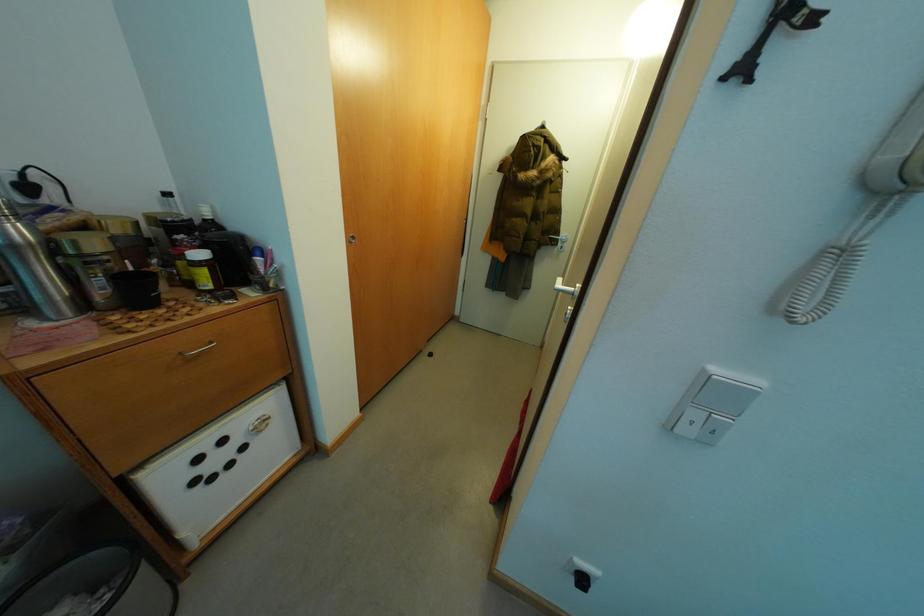
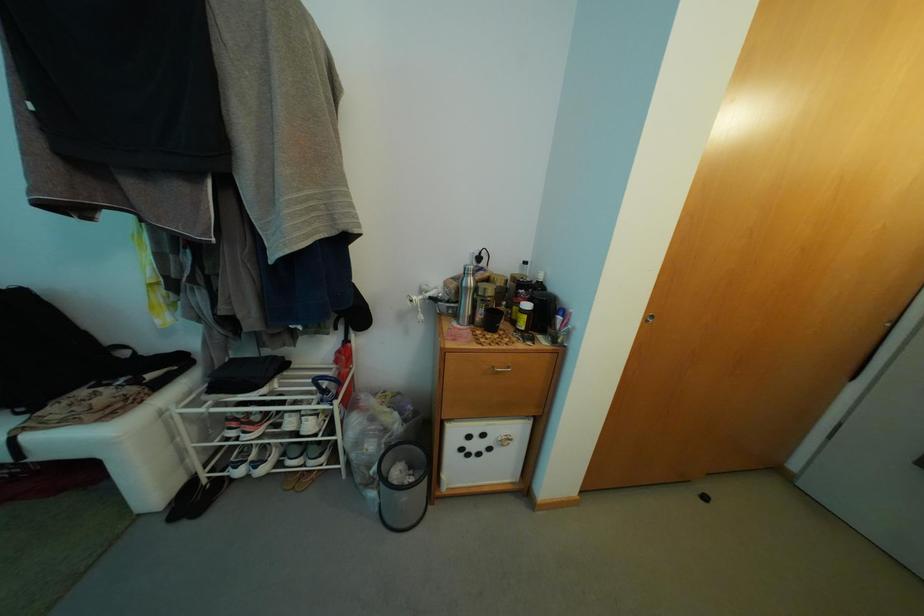
Question: The camera is either moving clockwise (left) or counter-clockwise (right) around the object. The first image is from the beginning of the video and the second image is from the end. Is the camera moving left or right when shooting the video?

Choices:
 (A) Left
 (B) Right

Answer: (B)